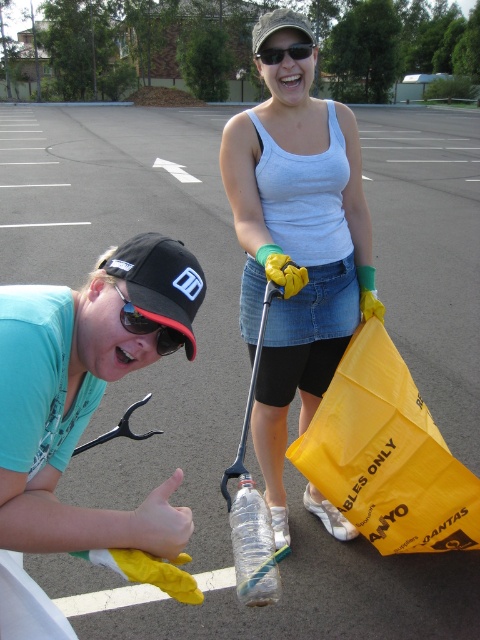
Question: Which object appears farthest from the camera in this image?

Choices:
 (A) yellow rubber glove at lower left
 (B) black fabric baseball cap at left

Answer: (B)

Question: Which point appears closest to the camera in this image?

Choices:
 (A) (146, 284)
 (B) (343, 125)

Answer: (A)

Question: Does denim skirt at center lie behind black plastic goggles at lower left?

Choices:
 (A) no
 (B) yes

Answer: (B)

Question: Is transparent plastic bottle at center positioned before camouflage fabric baseball cap at upper center?

Choices:
 (A) no
 (B) yes

Answer: (B)

Question: Which object is positioned farthest from the denim skirt at center?

Choices:
 (A) black plastic goggles at lower left
 (B) yellow rubber glove at lower left
 (C) camouflage fabric baseball cap at upper center
 (D) black fabric baseball cap at left

Answer: (C)

Question: Is yellow rubber glove at lower left to the right of black plastic goggles at lower left from the viewer's perspective?

Choices:
 (A) yes
 (B) no

Answer: (B)